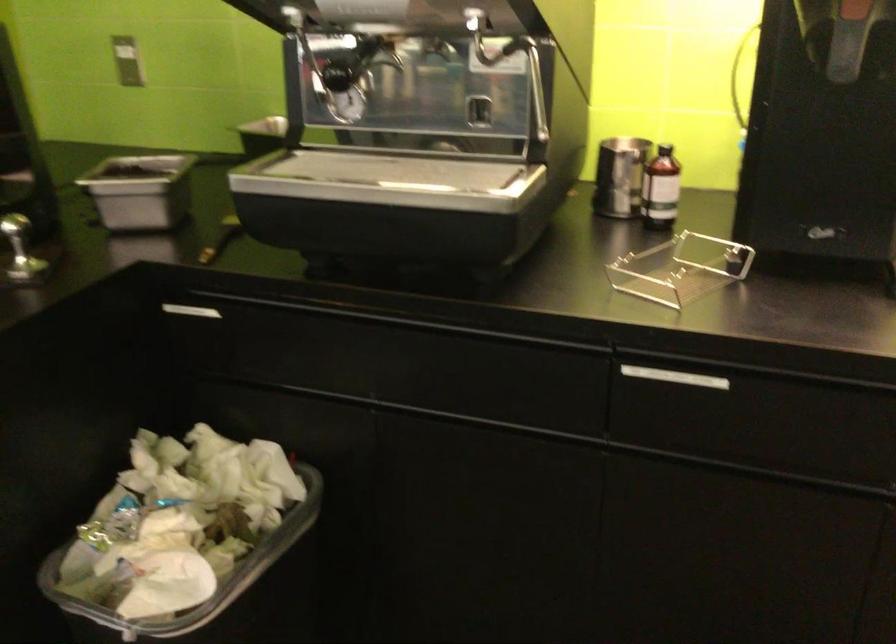
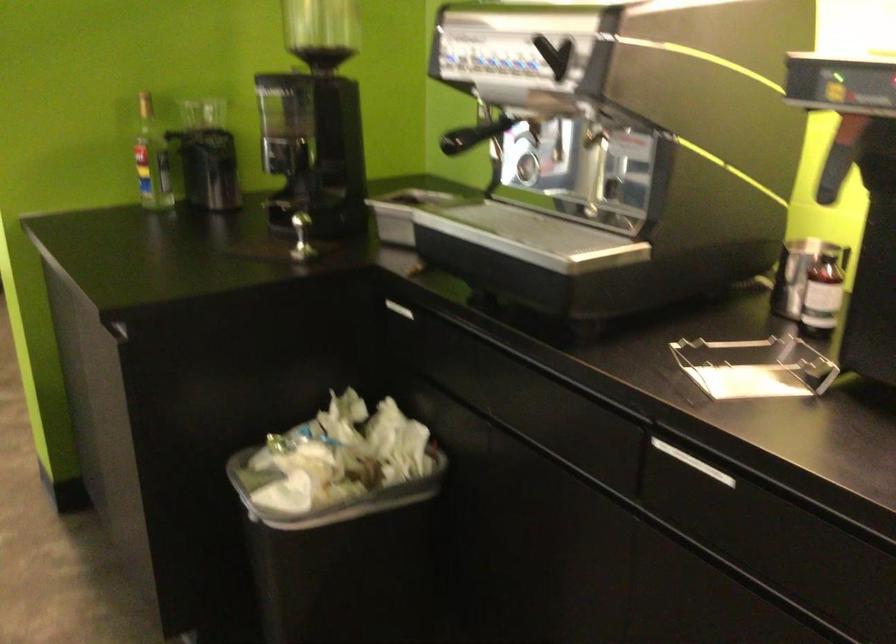
In the second image, find the point that corresponds to (x=673, y=187) in the first image.

(822, 294)